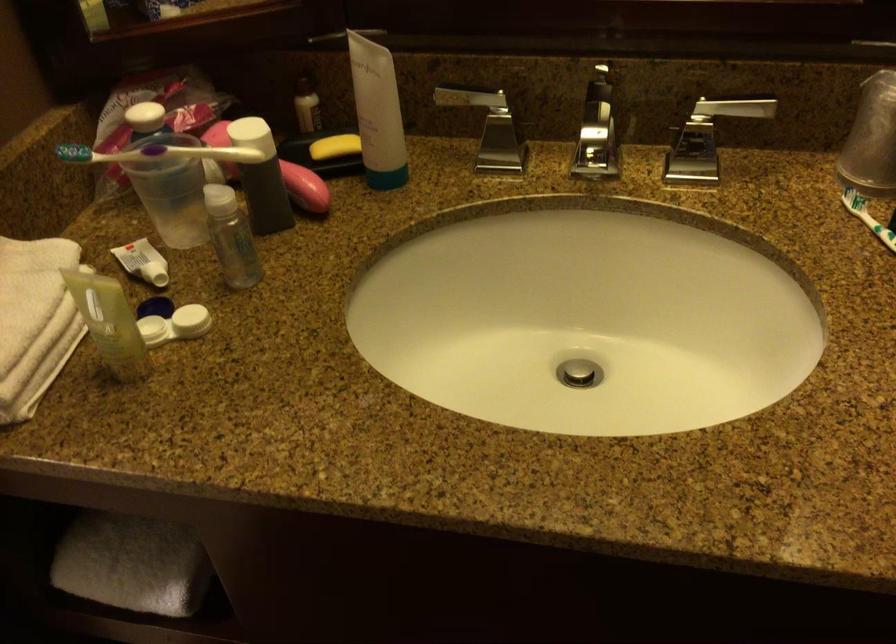
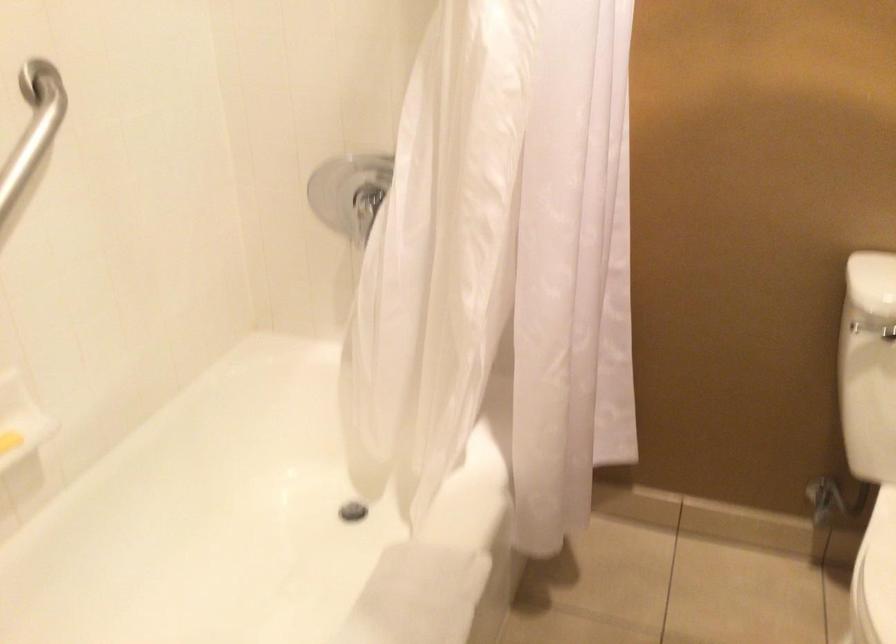
The images are taken continuously from a first-person perspective. In which direction is your viewpoint rotating?

The camera's rotation is toward left-down.